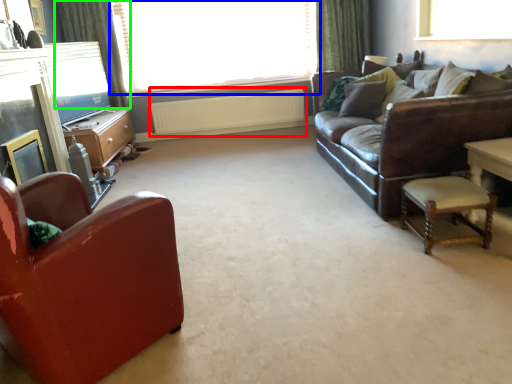
Question: Based on their relative distances, which object is farther from radiator (highlighted by a red box)? Choose from window (highlighted by a blue box) and curtain (highlighted by a green box).

Choices:
 (A) window
 (B) curtain

Answer: (B)